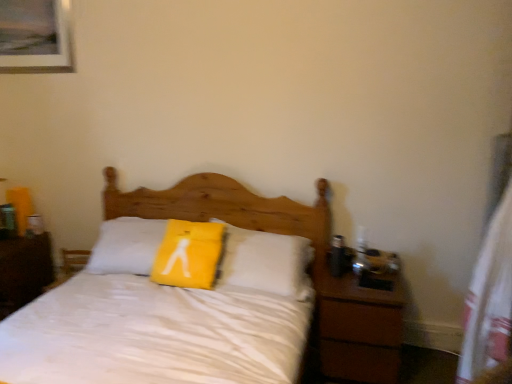
The height and width of the screenshot is (384, 512). What do you see at coordinates (24, 270) in the screenshot?
I see `brown wood nightstand at left, which ranks as the 2th nightstand in right-to-left order` at bounding box center [24, 270].

Locate an element on the screen. Image resolution: width=512 pixels, height=384 pixels. wooden picture frame at upper left is located at coordinates (35, 36).

Image resolution: width=512 pixels, height=384 pixels. What do you see at coordinates (222, 205) in the screenshot?
I see `white matte bed at center` at bounding box center [222, 205].

Locate an element on the screen. This screenshot has height=384, width=512. brown wood nightstand at left, which ranks as the 2th nightstand in right-to-left order is located at coordinates (24, 270).

From the image's perspective, which object appears higher, brown wooden nightstand at right, placed as the 1th nightstand when sorted from right to left, or yellow fabric pillow at center?

yellow fabric pillow at center is shown above in the image.

Is brown wooden nightstand at right, which is the second nightstand from left to right, wider than yellow fabric pillow at center?

Correct, the width of brown wooden nightstand at right, which is the second nightstand from left to right, exceeds that of yellow fabric pillow at center.

In terms of height, does brown wooden nightstand at right, which is the second nightstand from left to right, look taller or shorter compared to yellow fabric pillow at center?

Considering their sizes, brown wooden nightstand at right, which is the second nightstand from left to right, has more height than yellow fabric pillow at center.

Which is less distant, (x=362, y=335) or (x=200, y=280)?

Clearly, point (x=362, y=335) is closer to the camera than point (x=200, y=280).

Which object is closer to the camera, white matte bed at center or brown wooden nightstand at right, which is the second nightstand from left to right?

white matte bed at center.

Is white matte bed at center to the right of brown wooden nightstand at right, which is the second nightstand from left to right, from the viewer's perspective?

In fact, white matte bed at center is to the left of brown wooden nightstand at right, which is the second nightstand from left to right.

Does point (294, 213) appear closer or farther from the camera than point (343, 331)?

Point (294, 213) is farther from the camera than point (343, 331).

Is white matte bed at center touching brown wooden nightstand at right, which is the second nightstand from left to right?

No, white matte bed at center is not making contact with brown wooden nightstand at right, which is the second nightstand from left to right.

Consider the image. Who is smaller, yellow fabric pillow at center or brown wood nightstand at left, which ranks as the 2th nightstand in right-to-left order?

With smaller size is yellow fabric pillow at center.

Considering the sizes of objects yellow fabric pillow at center and brown wood nightstand at left, which is the 1th nightstand from left to right, in the image provided, who is shorter, yellow fabric pillow at center or brown wood nightstand at left, which is the 1th nightstand from left to right,?

With less height is brown wood nightstand at left, which is the 1th nightstand from left to right.

Find the location of `nightstand that is the 1st one when counting downward from the yellow fabric pillow at center (from the image's perspective)`. nightstand that is the 1st one when counting downward from the yellow fabric pillow at center (from the image's perspective) is located at coordinates (24, 270).

Is yellow fabric pillow at center turned away from brown wood nightstand at left, which ranks as the 2th nightstand in right-to-left order?

No, brown wood nightstand at left, which ranks as the 2th nightstand in right-to-left order, is not at the back of yellow fabric pillow at center.

The width and height of the screenshot is (512, 384). Find the location of `nightstand above the brown wooden nightstand at right, which is the second nightstand from left to right (from a real-world perspective)`. nightstand above the brown wooden nightstand at right, which is the second nightstand from left to right (from a real-world perspective) is located at coordinates (24, 270).

Considering the positions of objects brown wood nightstand at left, which ranks as the 2th nightstand in right-to-left order, and brown wooden nightstand at right, which is the second nightstand from left to right, in the image provided, who is in front, brown wood nightstand at left, which ranks as the 2th nightstand in right-to-left order, or brown wooden nightstand at right, which is the second nightstand from left to right,?

brown wooden nightstand at right, which is the second nightstand from left to right.

Is brown wood nightstand at left, which ranks as the 2th nightstand in right-to-left order, inside or outside of brown wooden nightstand at right, which is the second nightstand from left to right?

brown wood nightstand at left, which ranks as the 2th nightstand in right-to-left order, lies outside brown wooden nightstand at right, which is the second nightstand from left to right.

Looking at this image, is brown wood nightstand at left, which is the 1th nightstand from left to right, at the right side of brown wooden nightstand at right, placed as the 1th nightstand when sorted from right to left?

In fact, brown wood nightstand at left, which is the 1th nightstand from left to right, is to the left of brown wooden nightstand at right, placed as the 1th nightstand when sorted from right to left.

Is wooden picture frame at upper left positioned before yellow fabric pillow at center?

No, wooden picture frame at upper left is behind yellow fabric pillow at center.

Which is in front, point (16, 14) or point (185, 252)?

Positioned in front is point (185, 252).

Is the surface of wooden picture frame at upper left in direct contact with yellow fabric pillow at center?

No, wooden picture frame at upper left is not next to yellow fabric pillow at center.

From the image's perspective, does wooden picture frame at upper left appear higher than yellow fabric pillow at center?

Yes, from the image's perspective, wooden picture frame at upper left is above yellow fabric pillow at center.

Does white matte bed at center appear on the right side of wooden picture frame at upper left?

Correct, you'll find white matte bed at center to the right of wooden picture frame at upper left.

In terms of size, does white matte bed at center appear bigger or smaller than wooden picture frame at upper left?

Considering their sizes, white matte bed at center takes up more space than wooden picture frame at upper left.

Considering the sizes of objects white matte bed at center and wooden picture frame at upper left in the image provided, who is thinner, white matte bed at center or wooden picture frame at upper left?

Thinner between the two is wooden picture frame at upper left.

How many degrees apart are the facing directions of white matte bed at center and yellow fabric pillow at center?

There is a 9.65-degree angle between the facing directions of white matte bed at center and yellow fabric pillow at center.

From the image's perspective, which is below, white matte bed at center or yellow fabric pillow at center?

white matte bed at center, from the image's perspective.

Which is less distant, (5,284) or (196,257)?

The point (196,257) is closer to the camera.

There is a yellow fabric pillow at center. At what (x,y) coordinates should I click in order to perform the action: click on the 2nd nightstand below it (from a real-world perspective). Please return your answer as a coordinate pair (x, y). The image size is (512, 384). Looking at the image, I should click on (359, 328).

From the image's perspective, starting from the white matte bed at center, which nightstand is the 2nd one below? Please provide its 2D coordinates.

[(359, 328)]

From the image, which object appears to be farther from yellow fabric pillow at center, brown wood nightstand at left, which ranks as the 2th nightstand in right-to-left order, or wooden picture frame at upper left?

wooden picture frame at upper left.

Based on their spatial positions, is brown wooden nightstand at right, which is the second nightstand from left to right, or wooden picture frame at upper left further from yellow fabric pillow at center?

Based on the image, wooden picture frame at upper left appears to be further to yellow fabric pillow at center.

Based on their spatial positions, is brown wood nightstand at left, which is the 1th nightstand from left to right, or white matte bed at center closer to wooden picture frame at upper left?

The object closer to wooden picture frame at upper left is white matte bed at center.

Based on their spatial positions, is brown wooden nightstand at right, placed as the 1th nightstand when sorted from right to left, or brown wood nightstand at left, which is the 1th nightstand from left to right, further from wooden picture frame at upper left?

The object further to wooden picture frame at upper left is brown wooden nightstand at right, placed as the 1th nightstand when sorted from right to left.

Looking at the image, which one is located closer to brown wood nightstand at left, which is the 1th nightstand from left to right, brown wooden nightstand at right, which is the second nightstand from left to right, or white matte bed at center?

white matte bed at center is closer to brown wood nightstand at left, which is the 1th nightstand from left to right.

Considering their positions, is wooden picture frame at upper left positioned further to white matte bed at center than brown wood nightstand at left, which ranks as the 2th nightstand in right-to-left order?

Based on the image, wooden picture frame at upper left appears to be further to white matte bed at center.

From the image, which object appears to be farther from brown wood nightstand at left, which ranks as the 2th nightstand in right-to-left order, wooden picture frame at upper left or yellow fabric pillow at center?

wooden picture frame at upper left.

Which object lies further to the anchor point brown wooden nightstand at right, which is the second nightstand from left to right, wooden picture frame at upper left or white matte bed at center?

wooden picture frame at upper left.

Where is `pillow situated between brown wood nightstand at left, which ranks as the 2th nightstand in right-to-left order, and brown wooden nightstand at right, placed as the 1th nightstand when sorted from right to left, from left to right`? This screenshot has width=512, height=384. pillow situated between brown wood nightstand at left, which ranks as the 2th nightstand in right-to-left order, and brown wooden nightstand at right, placed as the 1th nightstand when sorted from right to left, from left to right is located at coordinates (188, 254).

Where is `pillow between white matte bed at center and brown wood nightstand at left, which ranks as the 2th nightstand in right-to-left order, along the z-axis`? pillow between white matte bed at center and brown wood nightstand at left, which ranks as the 2th nightstand in right-to-left order, along the z-axis is located at coordinates (188, 254).

Locate an element on the screen. The height and width of the screenshot is (384, 512). picture frame between brown wood nightstand at left, which ranks as the 2th nightstand in right-to-left order, and brown wooden nightstand at right, which is the second nightstand from left to right, from left to right is located at coordinates (35, 36).

I want to click on pillow that lies between wooden picture frame at upper left and brown wood nightstand at left, which ranks as the 2th nightstand in right-to-left order, from top to bottom, so click(188, 254).